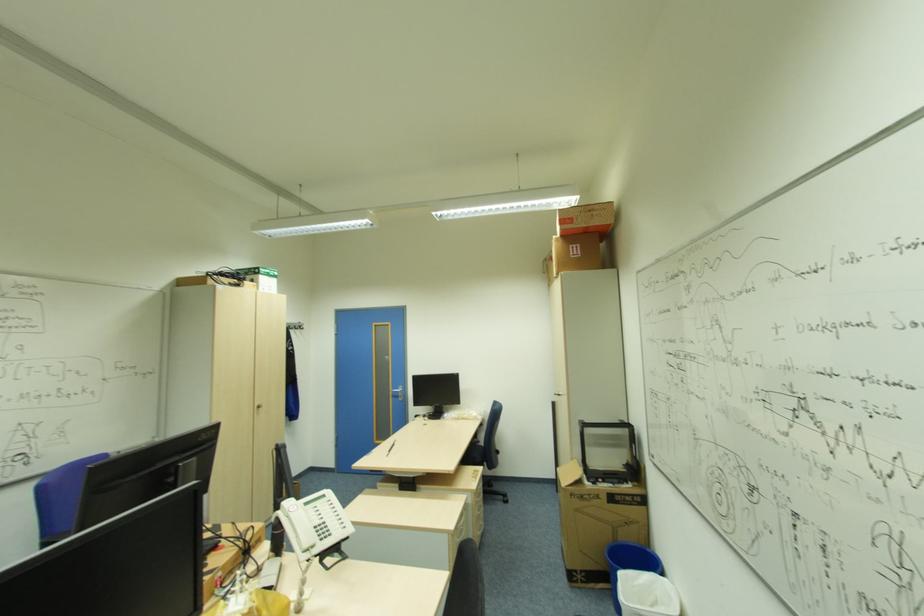
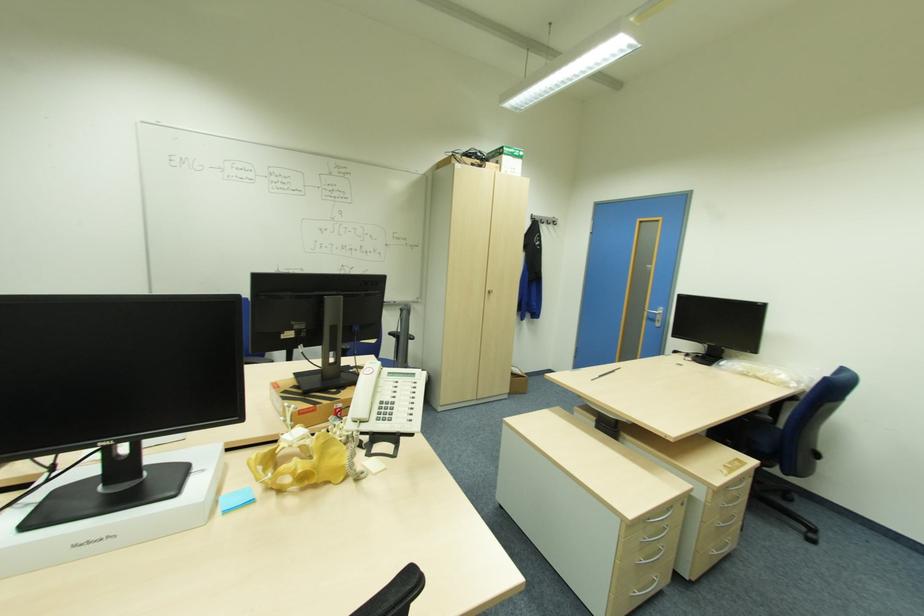
Find the pixel in the second image that matches (311,549) in the first image.

(359, 422)